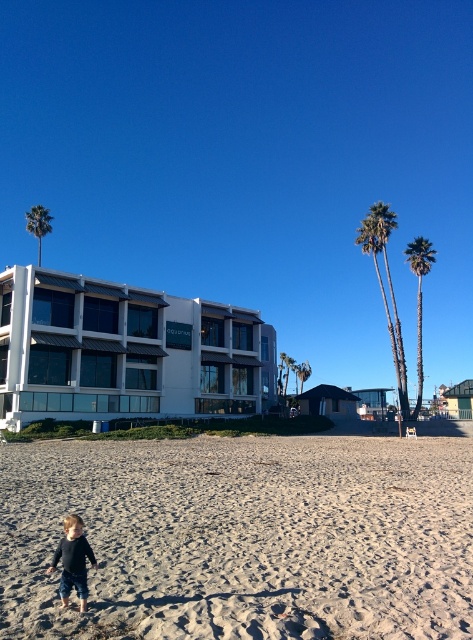
Question: Which of the following is the farthest from the observer?

Choices:
 (A) green leafy palm tree at center
 (B) white glass building at center
 (C) green leafy palm tree at upper left
 (D) green leafy palm trees at upper right

Answer: (A)

Question: Which object appears closest to the camera in this image?

Choices:
 (A) green leafy palm tree at upper left
 (B) sandy beach at lower left
 (C) dark blue denim pants at lower left

Answer: (B)

Question: Among these objects, which one is nearest to the camera?

Choices:
 (A) green leafy palm trees at upper right
 (B) dark blue denim pants at lower left

Answer: (B)

Question: Can you confirm if white glass building at center is wider than green leafy palm tree at upper left?

Choices:
 (A) yes
 (B) no

Answer: (B)

Question: Does sandy beach at lower left lie behind green leafy palm tree at upper left?

Choices:
 (A) yes
 (B) no

Answer: (B)

Question: Does sandy beach at lower left appear on the right side of green leafy palm tree at center?

Choices:
 (A) yes
 (B) no

Answer: (B)